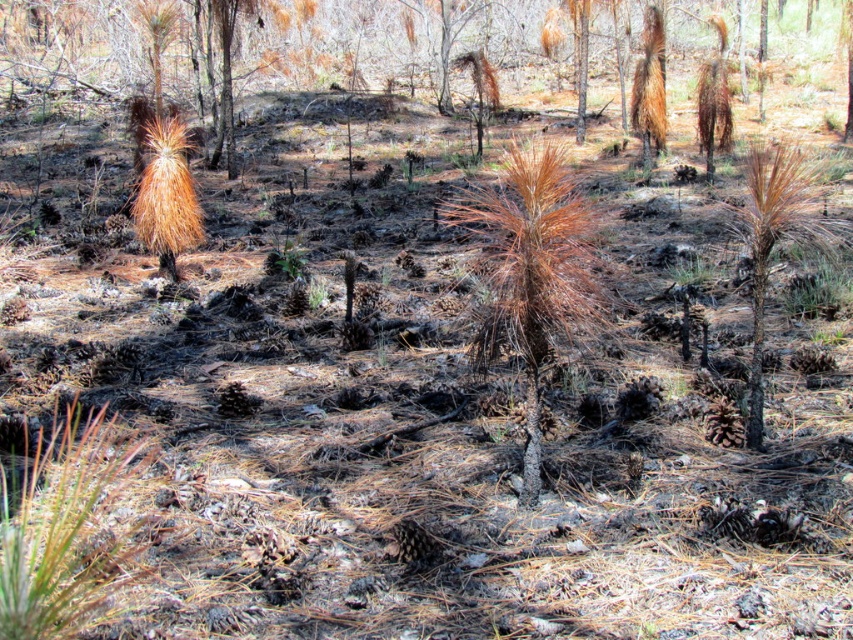
You are standing at the point with coordinates point [740,209] and want to walk towards the point with coordinates point [560,276]. Which direction should you move relative to your current position?

You should move forward because point [560,276] is in front of point [740,209].